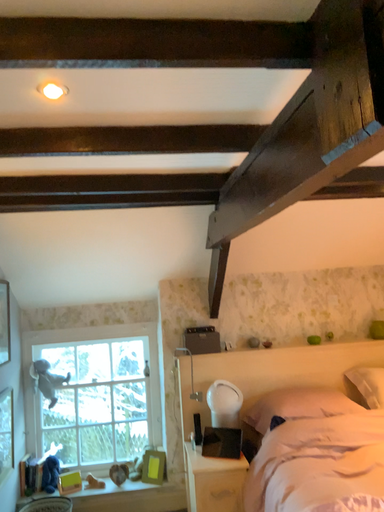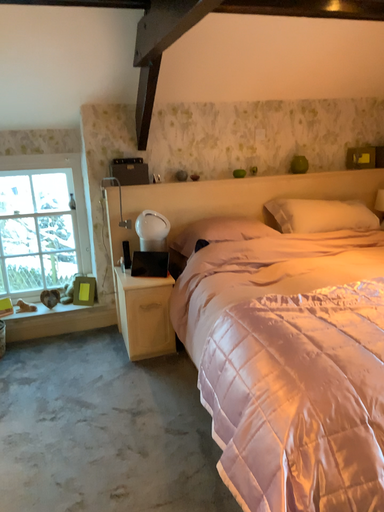
Question: Which way did the camera rotate in the video?

Choices:
 (A) rotated right
 (B) rotated left

Answer: (A)